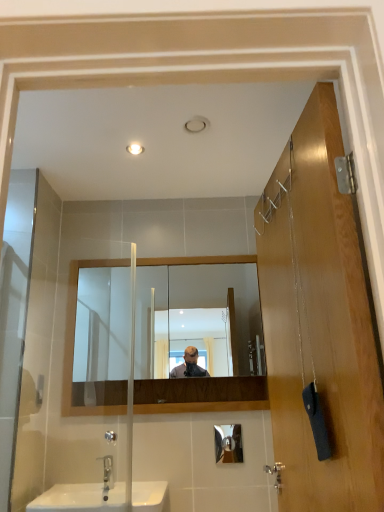
Question: In terms of size, does wooden door at right appear bigger or smaller than silver metallic faucet at lower left?

Choices:
 (A) big
 (B) small

Answer: (A)

Question: From a real-world perspective, is wooden door at right above or below silver metallic faucet at lower left?

Choices:
 (A) above
 (B) below

Answer: (A)

Question: Which object is positioned closest to the silver metallic faucet at lower left?

Choices:
 (A) clear glass mirror at center
 (B) wooden door at right
 (C) white glossy sink at lower left

Answer: (C)

Question: Which is farther from the wooden door at right?

Choices:
 (A) clear glass mirror at center
 (B) silver metallic faucet at lower left
 (C) white glossy sink at lower left

Answer: (B)